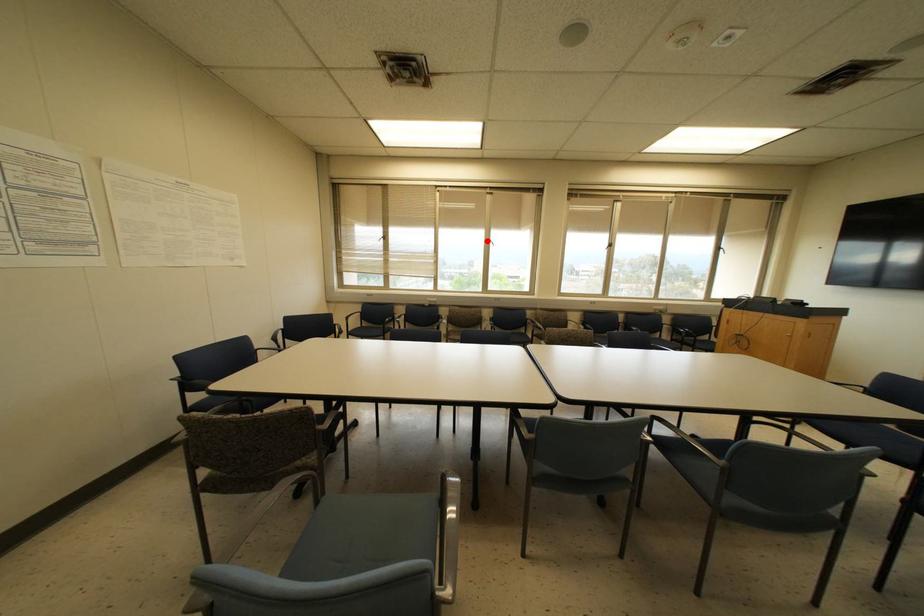
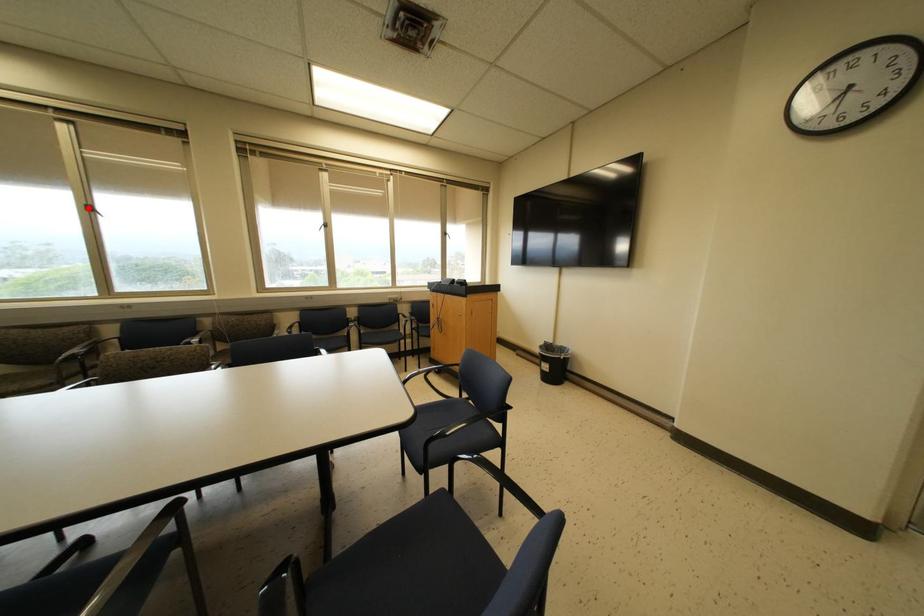
I am providing you with two images of the same scene from different viewpoints. A red point is marked on the first image and another point is marked on the second image. Is the red point in image1 aligned with the point shown in image2?

Yes